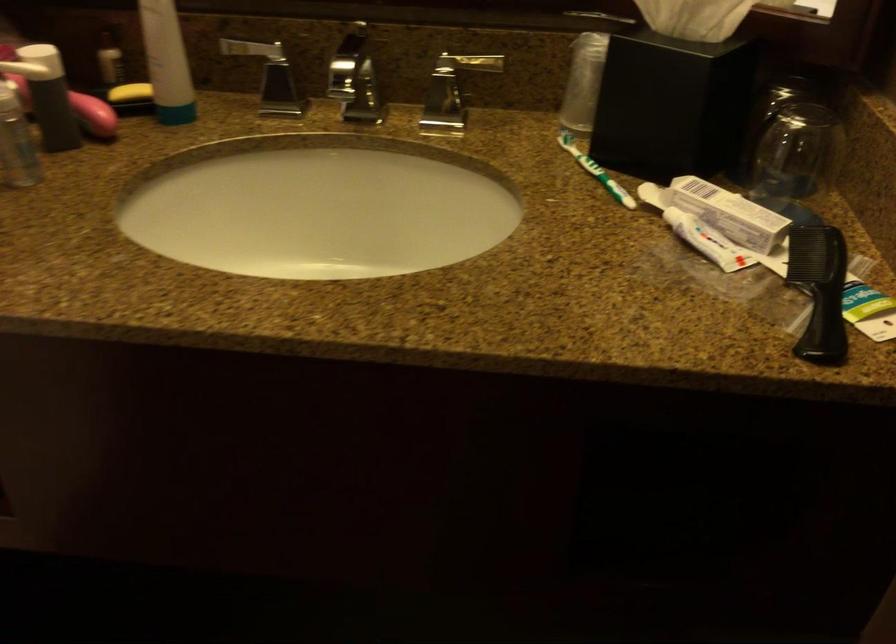
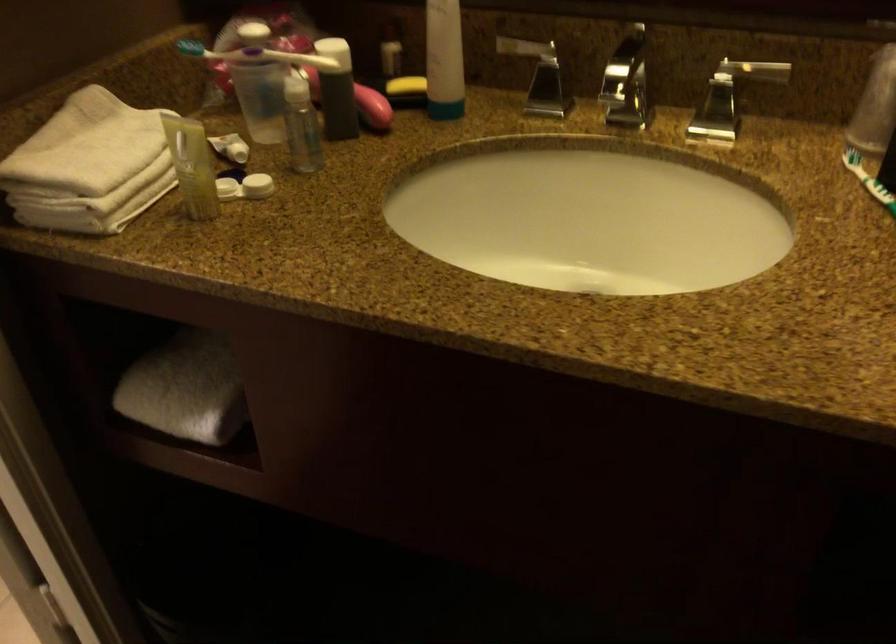
The point at (580, 154) is marked in the first image. Where is the corresponding point in the second image?

(867, 180)